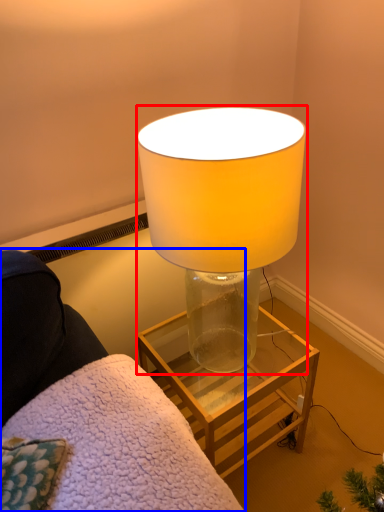
Question: Among these objects, which one is nearest to the camera, lamp (highlighted by a red box) or furniture (highlighted by a blue box)?

Choices:
 (A) lamp
 (B) furniture

Answer: (B)